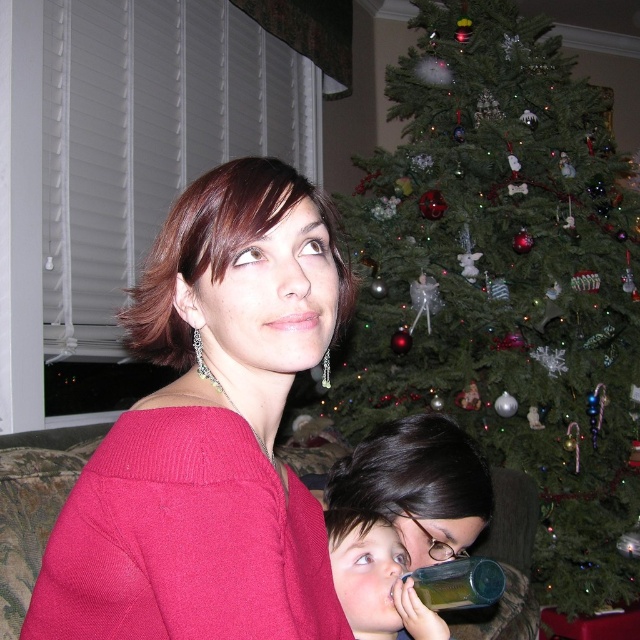
Question: Which object is farther from the camera taking this photo?

Choices:
 (A) matte pink sweater at center
 (B) green matte christmas tree at upper center
 (C) translucent plastic cup at lower center

Answer: (B)

Question: Which of the following is the farthest from the observer?

Choices:
 (A) (152, 472)
 (B) (618, 604)

Answer: (B)

Question: Considering the relative positions of green matte christmas tree at upper center and matte pink sweater at center in the image provided, where is green matte christmas tree at upper center located with respect to matte pink sweater at center?

Choices:
 (A) left
 (B) right

Answer: (B)

Question: Is smooth plastic bottle at lower center to the left of translucent plastic cup at lower center from the viewer's perspective?

Choices:
 (A) yes
 (B) no

Answer: (A)

Question: Which of the following is the closest to the observer?

Choices:
 (A) (481, 579)
 (B) (74, 525)
 (C) (636, 480)

Answer: (B)

Question: Is the position of matte pink sweater at center less distant than that of translucent plastic cup at lower center?

Choices:
 (A) yes
 (B) no

Answer: (A)